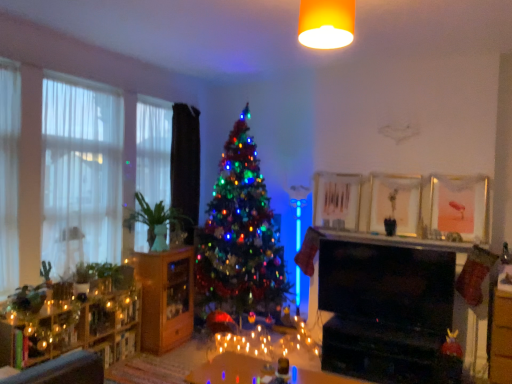
The width and height of the screenshot is (512, 384). Find the location of `free point below metallic gold picture frame at upper center, which ranks as the second picture frame in right-to-left order (from a real-world perspective)`. free point below metallic gold picture frame at upper center, which ranks as the second picture frame in right-to-left order (from a real-world perspective) is located at coordinates [388, 231].